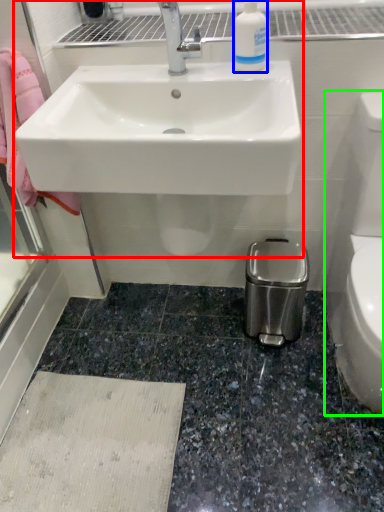
Question: Based on their relative distances, which object is nearer to sink (highlighted by a red box)? Choose from cleaning product (highlighted by a blue box) and toilet bowl (highlighted by a green box).

Choices:
 (A) cleaning product
 (B) toilet bowl

Answer: (A)